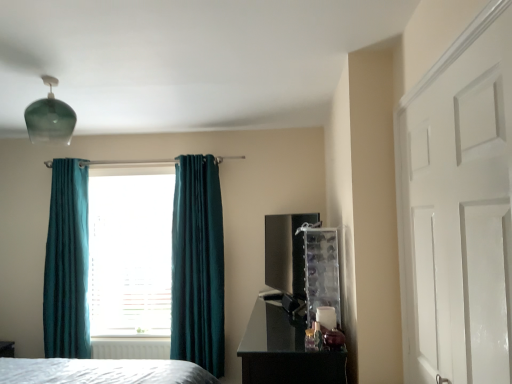
Identify the location of free point above green glass light fixture at upper left (from a real-world perspective). The image size is (512, 384). (42, 81).